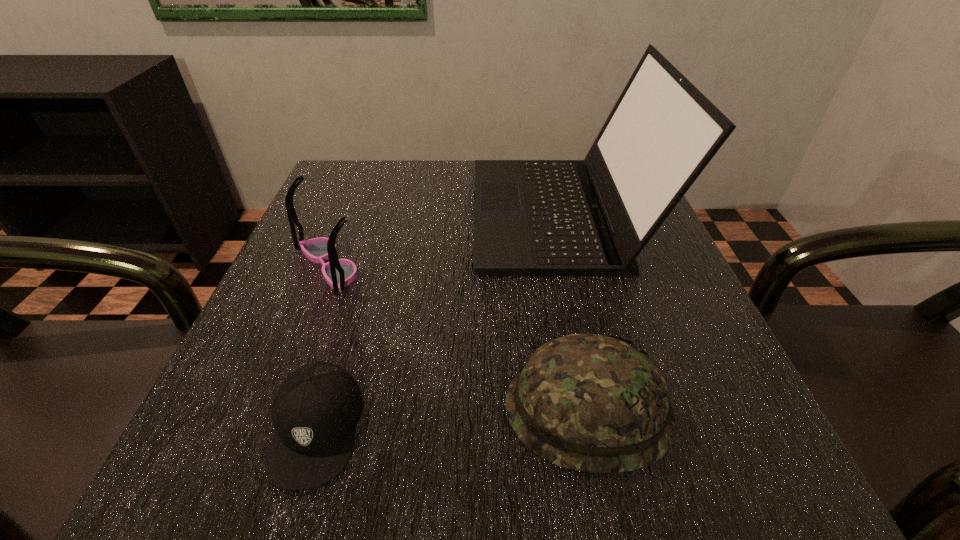
Image resolution: width=960 pixels, height=540 pixels. In the image, there is a desktop. Identify the location of vacant space at the near edge. (370, 462).

In the image, there is a desktop. Find the location of `blank space at the left edge`. blank space at the left edge is located at coordinates (351, 215).

Identify the location of free spot at the right edge of the desktop. (727, 367).

In the image, there is a desktop. Identify the location of vacant space at the far left corner. The width and height of the screenshot is (960, 540). (380, 195).

In the image, there is a desktop. At what (x,y) coordinates should I click in order to perform the action: click on free space at the near right corner. Please return your answer as a coordinate pair (x, y). This screenshot has width=960, height=540. Looking at the image, I should click on pos(650,466).

This screenshot has height=540, width=960. Find the location of `free space between the second shortest object and the laptop`. free space between the second shortest object and the laptop is located at coordinates (574, 311).

Locate an element on the screen. unoccupied position between the shorter cap and the laptop is located at coordinates (439, 320).

What are the coordinates of `free space between the tallest object and the right cap` in the screenshot? It's located at (574, 311).

Where is `vacant space in between the tallest object and the shorter cap`? The height and width of the screenshot is (540, 960). vacant space in between the tallest object and the shorter cap is located at coordinates (439, 320).

At what (x,y) coordinates should I click in order to perform the action: click on vacant area that lies between the right cap and the left cap. Please return your answer as a coordinate pair (x, y). The image size is (960, 540). Looking at the image, I should click on (451, 418).